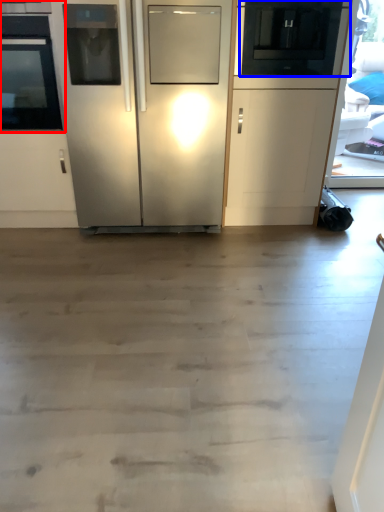
Question: Which object appears closest to the camera in this image, oven (highlighted by a red box) or appliance (highlighted by a blue box)?

Choices:
 (A) oven
 (B) appliance

Answer: (A)